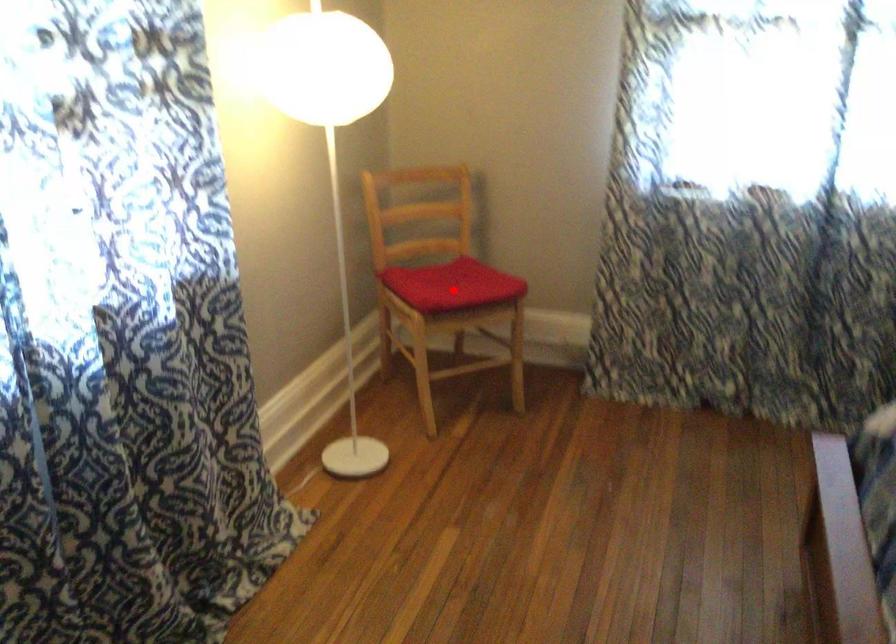
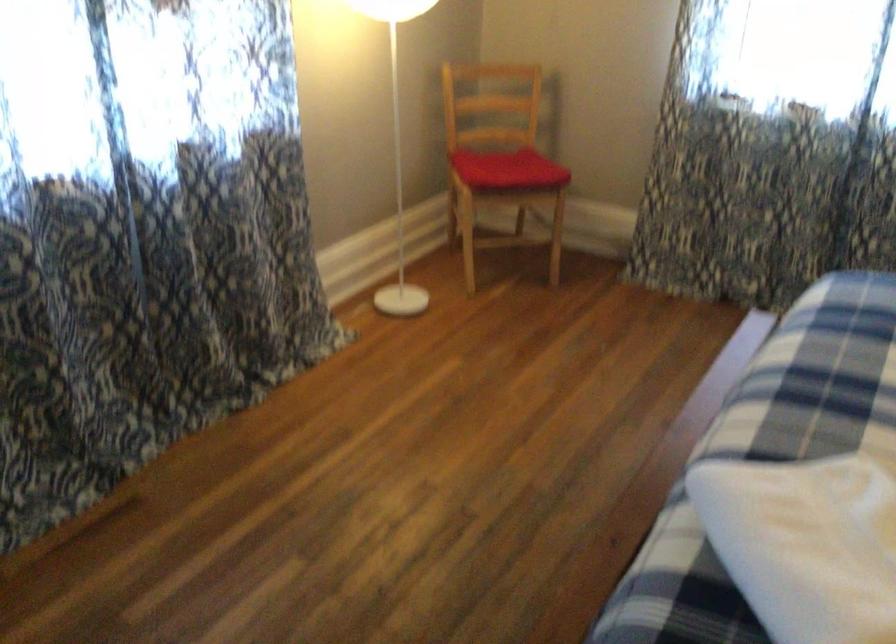
Find the pixel in the second image that matches the highlighted location in the first image.

(507, 169)